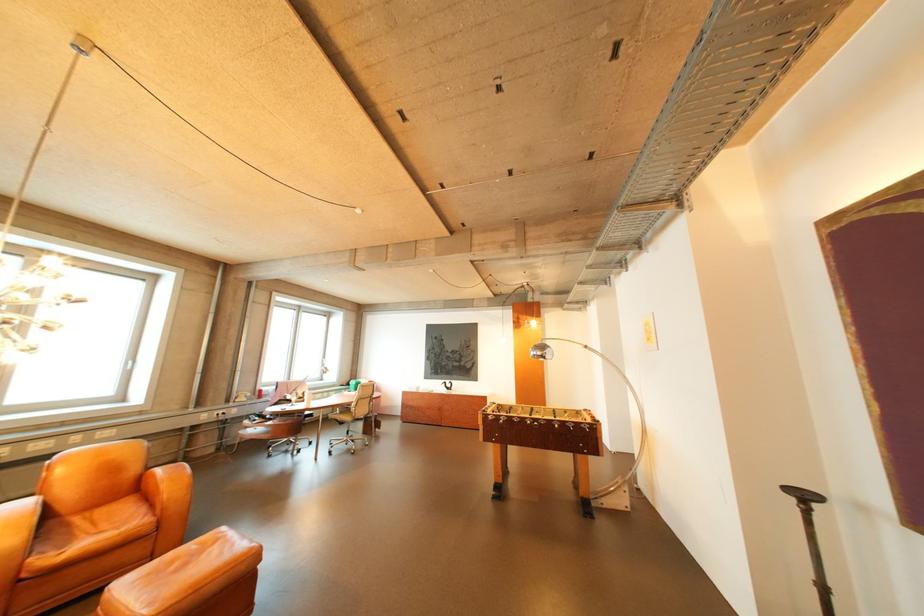
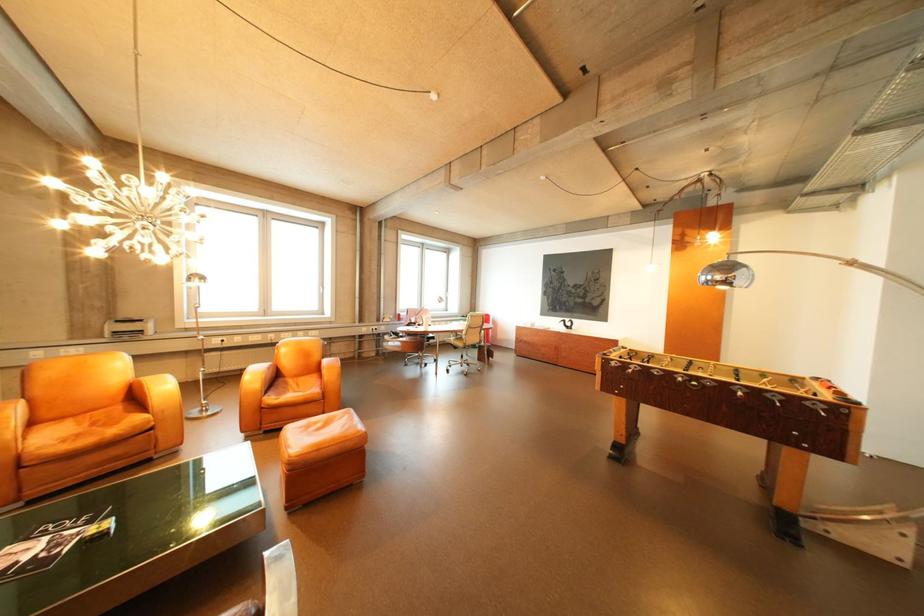
In the second image, find the point that corresponds to (61,560) in the first image.

(285, 400)